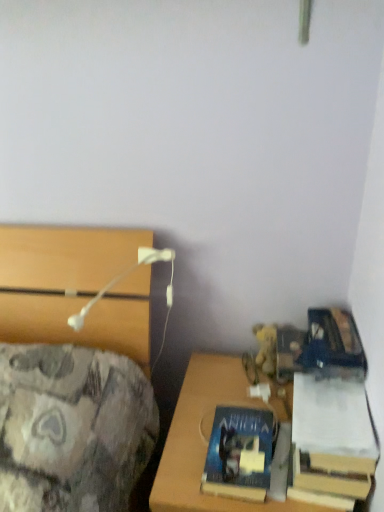
Question: Is blue matte book at lower right, which ranks as the 2th book in right-to-left order, not within yellow plush at right?

Choices:
 (A) yes
 (B) no

Answer: (A)

Question: Is the depth of blue matte book at lower right, the 1th book when ordered from left to right, less than that of yellow plush at right?

Choices:
 (A) no
 (B) yes

Answer: (B)

Question: From the image's perspective, is blue matte book at lower right, the 1th book when ordered from left to right, over yellow plush at right?

Choices:
 (A) yes
 (B) no

Answer: (B)

Question: Can you confirm if blue matte book at lower right, the 1th book when ordered from left to right, is wider than yellow plush at right?

Choices:
 (A) yes
 (B) no

Answer: (A)

Question: From a real-world perspective, is blue matte book at lower right, the 1th book when ordered from left to right, on top of yellow plush at right?

Choices:
 (A) no
 (B) yes

Answer: (A)

Question: Considering the positions of yellow plush at right and wooden desk at lower right in the image, is yellow plush at right bigger or smaller than wooden desk at lower right?

Choices:
 (A) big
 (B) small

Answer: (B)

Question: Does point (269, 358) appear closer or farther from the camera than point (173, 509)?

Choices:
 (A) farther
 (B) closer

Answer: (A)

Question: From the image's perspective, is yellow plush at right above or below wooden desk at lower right?

Choices:
 (A) above
 (B) below

Answer: (A)

Question: In the image, is yellow plush at right positioned in front of or behind wooden desk at lower right?

Choices:
 (A) behind
 (B) front

Answer: (A)

Question: Do you think blue matte book at lower right, the 1th book when ordered from left to right, is within hardcover book at lower right, which is the 2th book from left to right, or outside of it?

Choices:
 (A) inside
 (B) outside

Answer: (B)

Question: Visually, is blue matte book at lower right, the 1th book when ordered from left to right, positioned to the left or to the right of hardcover book at lower right, placed as the first book when sorted from right to left?

Choices:
 (A) right
 (B) left

Answer: (B)

Question: Is blue matte book at lower right, the 1th book when ordered from left to right, taller or shorter than hardcover book at lower right, which is the 2th book from left to right?

Choices:
 (A) short
 (B) tall

Answer: (B)

Question: Is blue matte book at lower right, which ranks as the 2th book in right-to-left order, in front of or behind hardcover book at lower right, which is the 2th book from left to right, in the image?

Choices:
 (A) front
 (B) behind

Answer: (B)

Question: Visually, is hardcover book at lower right, which is the 2th book from left to right, positioned to the left or to the right of yellow plush at right?

Choices:
 (A) right
 (B) left

Answer: (A)

Question: Relative to yellow plush at right, is hardcover book at lower right, placed as the first book when sorted from right to left, in front or behind?

Choices:
 (A) behind
 (B) front

Answer: (B)